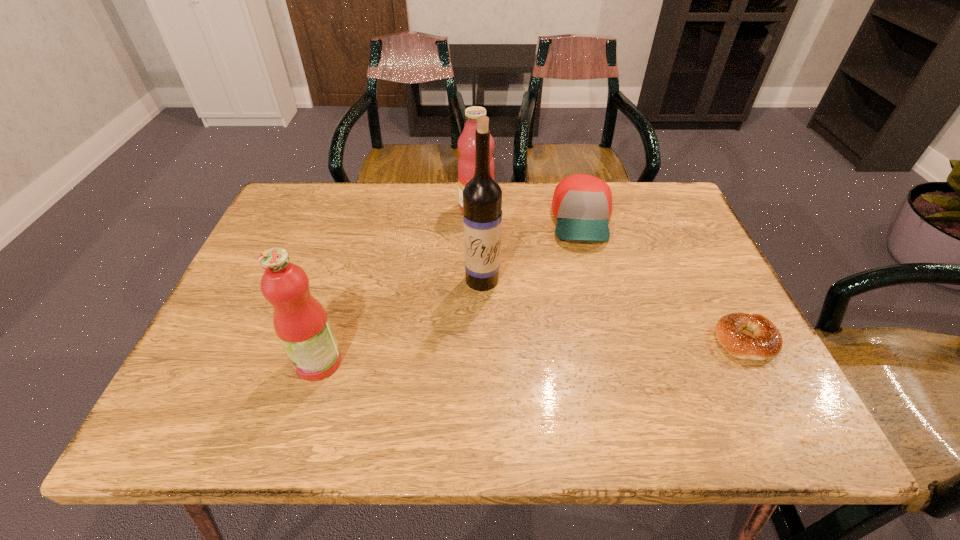
Find the location of a particular element. the nearer fruit juice is located at coordinates (300, 321).

Where is `the left fruit juice`? The width and height of the screenshot is (960, 540). the left fruit juice is located at coordinates (300, 321).

Locate an element on the screen. bagel is located at coordinates pyautogui.click(x=766, y=342).

Identify the location of the rightmost object. pos(766,342).

I want to click on baseball cap, so click(582, 204).

At what (x,y) coordinates should I click in order to perform the action: click on the second object from right to left. Please return your answer as a coordinate pair (x, y). Looking at the image, I should click on 582,204.

The width and height of the screenshot is (960, 540). I want to click on the right fruit juice, so click(x=466, y=145).

Identify the location of the third nearest object. The width and height of the screenshot is (960, 540). (482, 196).

Locate an element on the screen. The height and width of the screenshot is (540, 960). the tallest object is located at coordinates (482, 196).

Find the location of a particular element. The height and width of the screenshot is (540, 960). free region located 0.060m on the front label of the leftmost object is located at coordinates (267, 362).